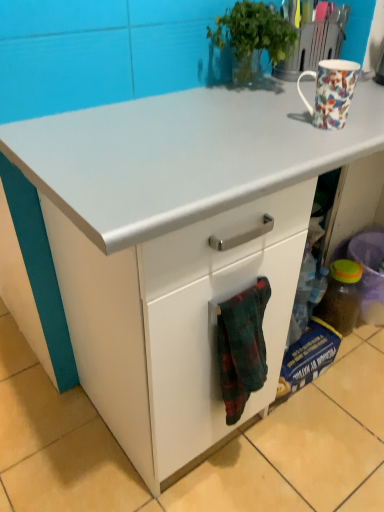
Where is `free point in front of translucent plastic bottle at lower right`? Image resolution: width=384 pixels, height=512 pixels. free point in front of translucent plastic bottle at lower right is located at coordinates (359, 362).